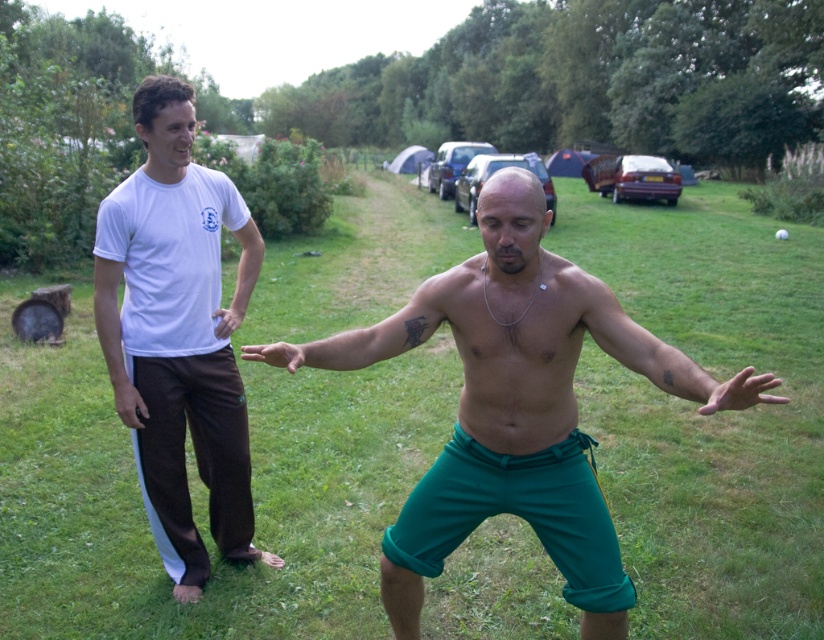
Question: Which of the following is the farthest from the observer?

Choices:
 (A) green grass at center
 (B) white cotton t-shirt at left

Answer: (A)

Question: Is white cotton t-shirt at left bigger than black matte phone at left?

Choices:
 (A) no
 (B) yes

Answer: (B)

Question: Among these objects, which one is farthest from the camera?

Choices:
 (A) matte white shirt at left
 (B) smooth skin hand at center
 (C) green fabric hand at center

Answer: (A)

Question: Is green grass at center to the left of smooth skin hand at center from the viewer's perspective?

Choices:
 (A) no
 (B) yes

Answer: (A)

Question: Which point appears closest to the camera in this image?

Choices:
 (A) pyautogui.click(x=275, y=344)
 (B) pyautogui.click(x=733, y=378)

Answer: (B)

Question: Can you confirm if green fabric hand at center is thinner than black matte phone at left?

Choices:
 (A) yes
 (B) no

Answer: (B)